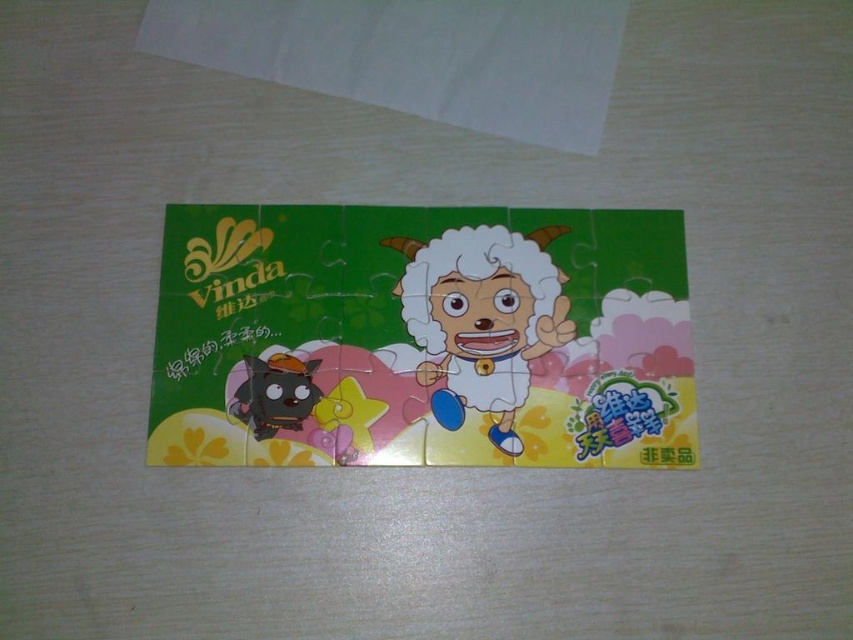
Can you confirm if white plush toy at center is wider than shiny black plush toy at bottom left?

Yes.

Which is behind, point (506, 406) or point (289, 429)?

The point (506, 406) is more distant.

This screenshot has height=640, width=853. What are the coordinates of `white plush toy at center` in the screenshot? It's located at (482, 317).